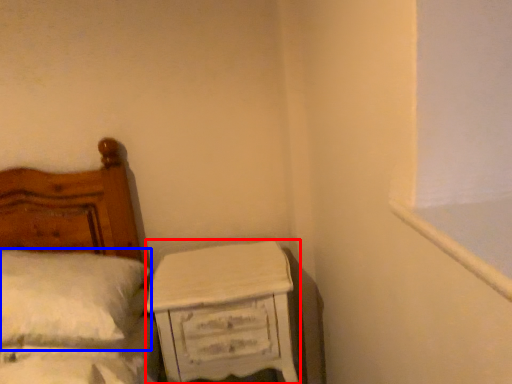
Question: Which point is closer to the camera, nightstand (highlighted by a red box) or pillow (highlighted by a blue box)?

Choices:
 (A) nightstand
 (B) pillow

Answer: (B)